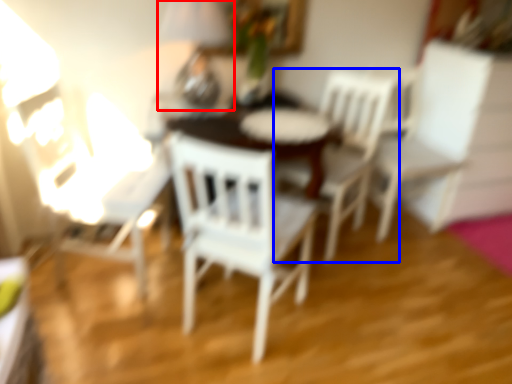
Question: Which object appears closest to the camera in this image, table lamp (highlighted by a red box) or chair (highlighted by a blue box)?

Choices:
 (A) table lamp
 (B) chair

Answer: (A)